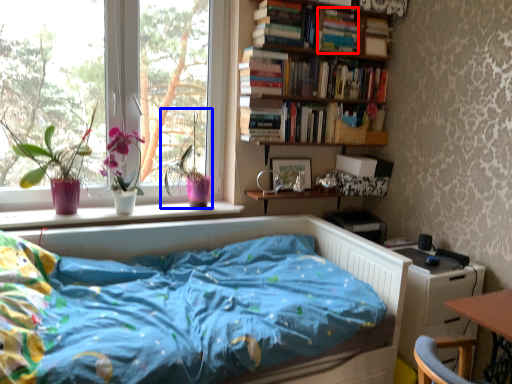
Question: Which point is closer to the camera, book (highlighted by a red box) or floral arrangement (highlighted by a blue box)?

Choices:
 (A) book
 (B) floral arrangement

Answer: (B)